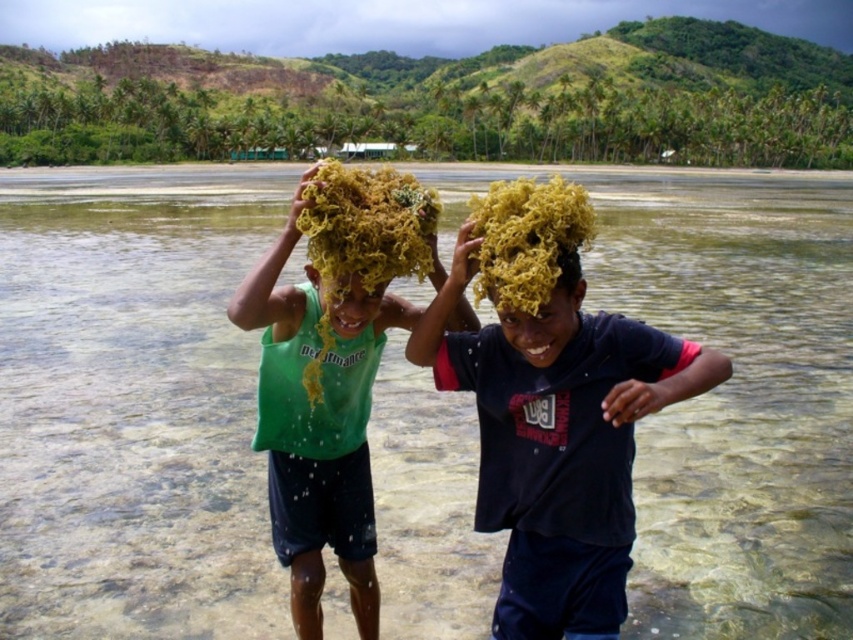
Can you confirm if clear water at center is positioned to the left of matte yellow seaweed at center?

Incorrect, clear water at center is not on the left side of matte yellow seaweed at center.

Is point (666, 429) closer to camera compared to point (561, 410)?

No, (666, 429) is behind (561, 410).

At what (x,y) coordinates should I click in order to perform the action: click on clear water at center. Please return your answer as a coordinate pair (x, y). This screenshot has height=640, width=853. Looking at the image, I should click on (132, 404).

What do you see at coordinates (323, 406) in the screenshot? I see `green matte seaweed at center` at bounding box center [323, 406].

Is point (276, 349) positioned after point (433, 193)?

Yes, point (276, 349) is farther from viewer.

At what (x,y) coordinates should I click in order to perform the action: click on green matte seaweed at center. Please return your answer as a coordinate pair (x, y). This screenshot has width=853, height=640. Looking at the image, I should click on (323, 406).

Can you confirm if clear water at center is positioned above yellow curly hair at center?

Yes.

Can you confirm if clear water at center is positioned to the left of yellow curly hair at center?

Incorrect, clear water at center is not on the left side of yellow curly hair at center.

Between point (842, 504) and point (474, 291), which one is positioned in front?

Point (474, 291) is in front.

You are a GUI agent. You are given a task and a screenshot of the screen. Output one action in this format:
    pyautogui.click(x=<x>, y=<y>)
    Task: Click on the clear water at center
    The width and height of the screenshot is (853, 640).
    Given the screenshot: What is the action you would take?
    pyautogui.click(x=132, y=404)